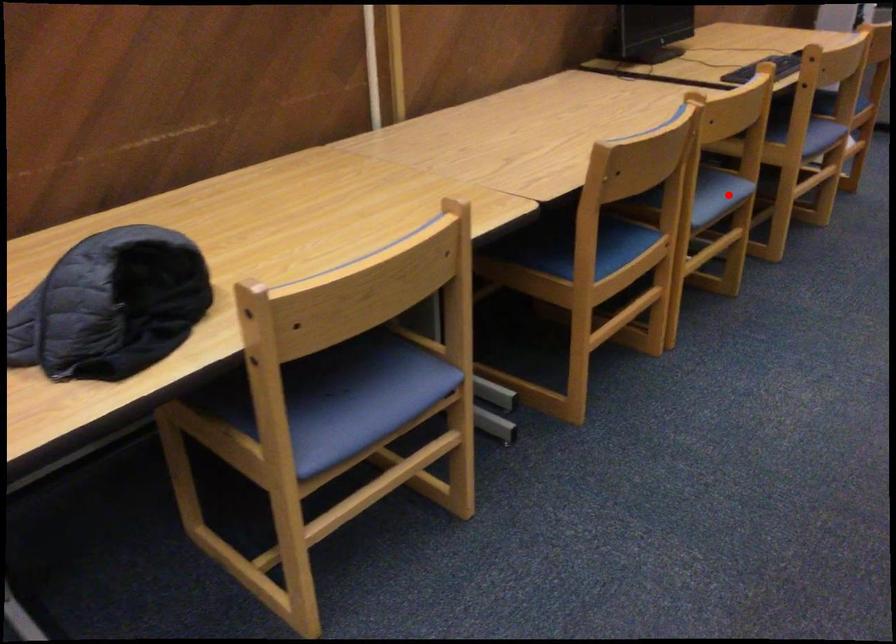
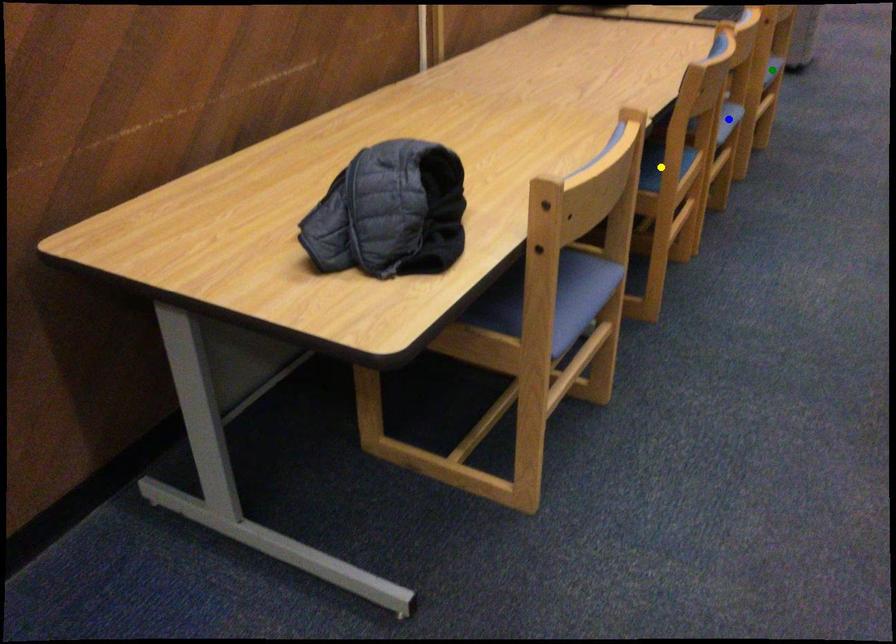
Question: I am providing you with two images of the same scene from different viewpoints. A red point is marked on the first image. You are given multiple points on the second image. Which point in image 2 represents the same 3d spot as the red point in image 1?

Choices:
 (A) green point
 (B) yellow point
 (C) blue point

Answer: (C)